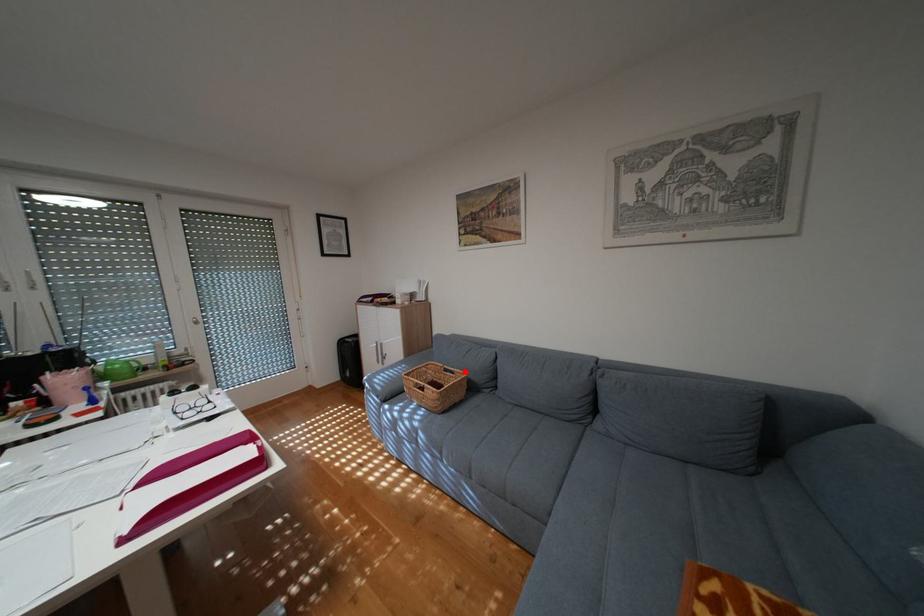
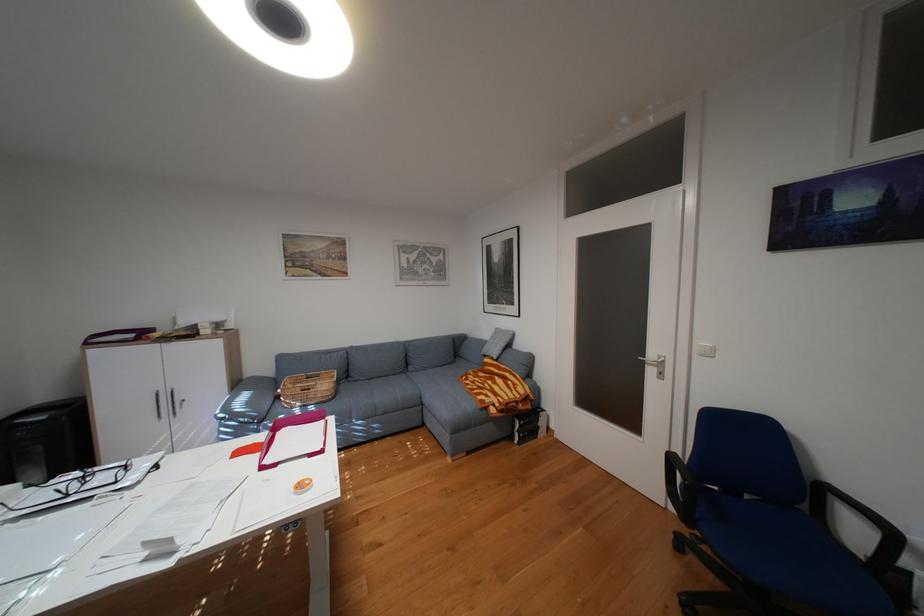
In the second image, find the point that corresponds to the highlighted location in the first image.

(331, 375)